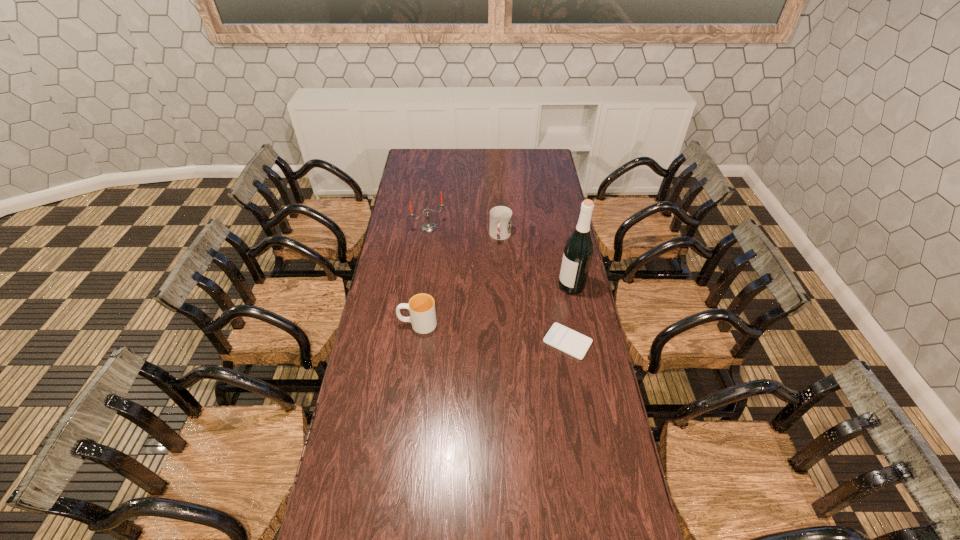
The height and width of the screenshot is (540, 960). I want to click on free space between the nearer cup and the fourth shortest object, so click(423, 276).

The height and width of the screenshot is (540, 960). What are the coordinates of `free space between the left cup and the candle` in the screenshot? It's located at (423, 276).

You are a GUI agent. You are given a task and a screenshot of the screen. Output one action in this format:
    pyautogui.click(x=<x>, y=<y>)
    Task: Click on the vacant area that lies between the left cup and the fourth shortest object
    
    Given the screenshot: What is the action you would take?
    pyautogui.click(x=423, y=276)

You are a GUI agent. You are given a task and a screenshot of the screen. Output one action in this format:
    pyautogui.click(x=<x>, y=<y>)
    Task: Click on the free spot between the tallest object and the shortest object
    This screenshot has height=540, width=960.
    Given the screenshot: What is the action you would take?
    pyautogui.click(x=569, y=314)

Find the location of a particular element. This screenshot has width=960, height=540. vacant point located between the left cup and the shortest object is located at coordinates (492, 333).

The width and height of the screenshot is (960, 540). In order to click on vacant point located between the farther cup and the left cup in this screenshot , I will do `click(459, 280)`.

Locate an element on the screen. Image resolution: width=960 pixels, height=540 pixels. object that can be found as the fourth closest to the candle is located at coordinates (560, 337).

Identify which object is located as the third nearest to the nearer cup. Please provide its 2D coordinates. Your answer should be formatted as a tuple, i.e. [(x, y)], where the tuple contains the x and y coordinates of a point satisfying the conditions above.

[(429, 226)]

What are the coordinates of `free location that satisfies the following two spatial constraints: 1. on the front side of the third object from left to right; 2. on the left side of the candle` in the screenshot? It's located at (428, 236).

What are the coordinates of `vacant space that satisfies the following two spatial constraints: 1. on the front side of the calculator; 2. on the right side of the candle` in the screenshot? It's located at (414, 342).